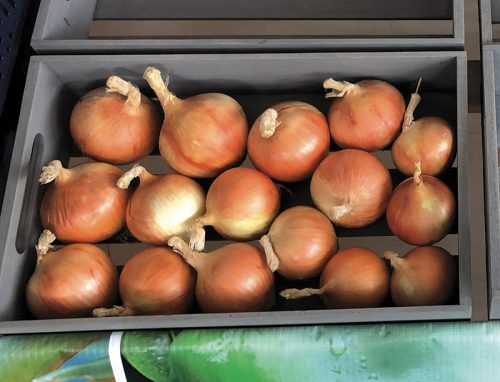
Identify the location of box. (453, 83).